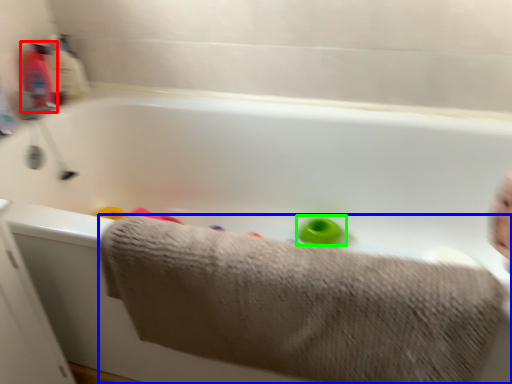
Question: Which is farther away from baby bottle (highlighted by a red box)? towel (highlighted by a blue box) or toy (highlighted by a green box)?

Choices:
 (A) towel
 (B) toy

Answer: (A)